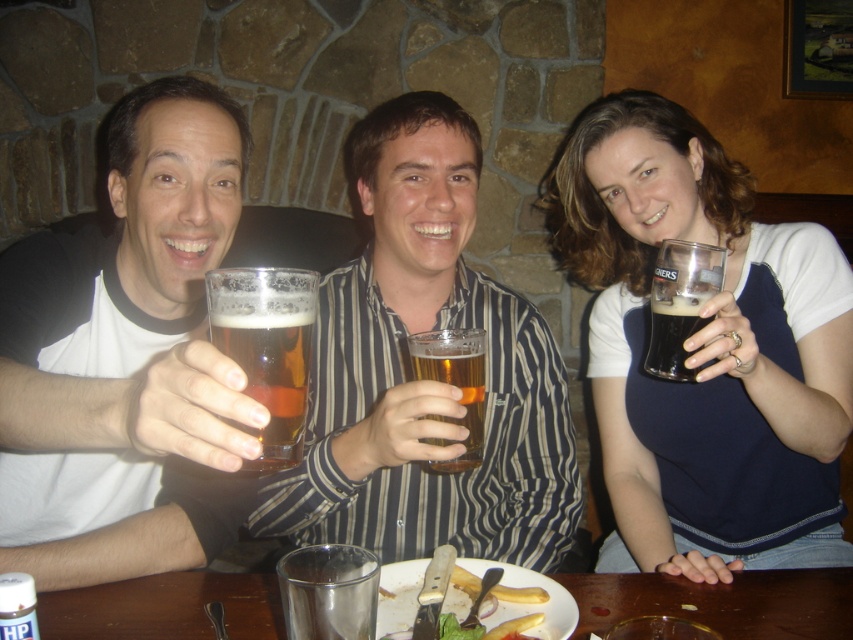
Question: Which point is closer to the camera?

Choices:
 (A) dark brown glass at right
 (B) translucent glass mug at center
 (C) yellowish matte fries at lower center

Answer: (C)

Question: Can you confirm if matte black glass at right is positioned above translucent glass beer at center?

Choices:
 (A) no
 (B) yes

Answer: (B)

Question: Can you confirm if matte black glass at right is smaller than yellowish matte fries at lower center?

Choices:
 (A) no
 (B) yes

Answer: (A)

Question: Which of the following is the closest to the observer?

Choices:
 (A) (553, 609)
 (B) (286, 401)

Answer: (B)

Question: Which of these objects is positioned farthest from the dark brown glass at right?

Choices:
 (A) translucent glass beer at center
 (B) wooden table at center
 (C) matte black glass at right

Answer: (A)

Question: Does matte black shirt at center appear on the right side of yellowish matte fries at lower center?

Choices:
 (A) yes
 (B) no

Answer: (B)